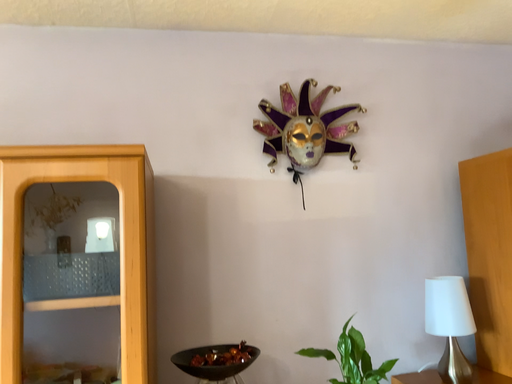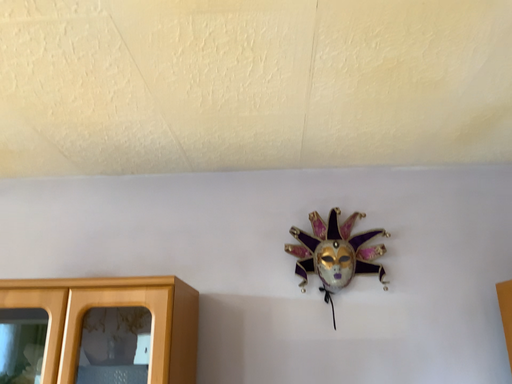
Question: How did the camera likely rotate when shooting the video?

Choices:
 (A) rotated right
 (B) rotated left

Answer: (B)